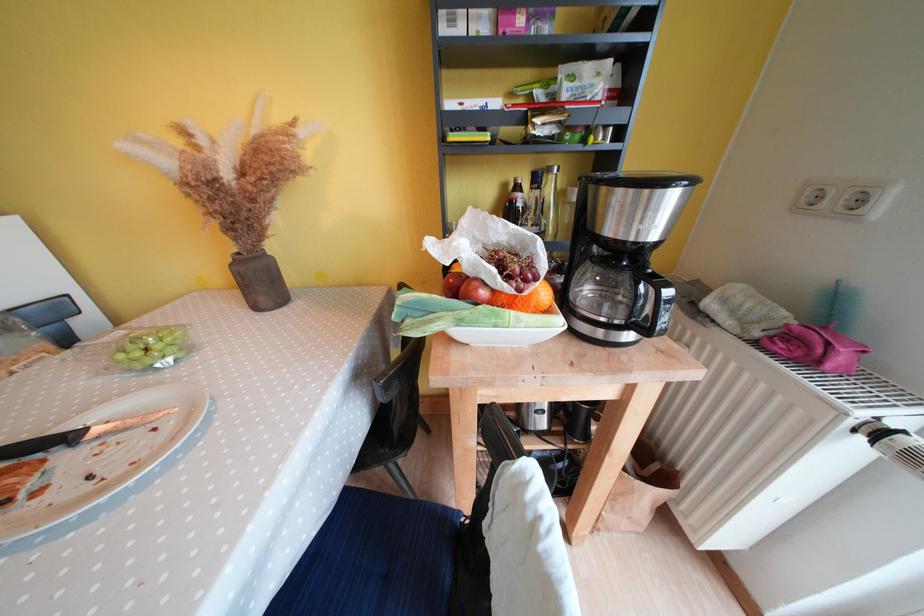
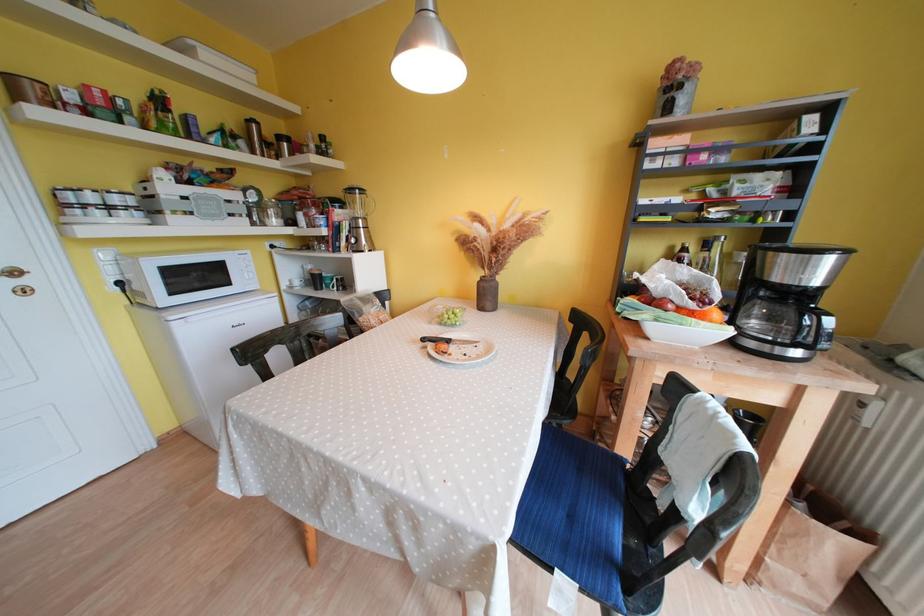
Which direction would the cameraman need to move to produce the second image?

The movement direction of the cameraman is left, backward.